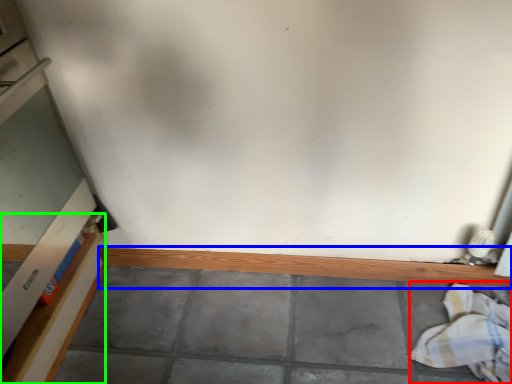
Question: Which object is positioned farthest from laundry (highlighted by a red box)? Select from ledge (highlighted by a blue box) and shelf (highlighted by a green box).

Choices:
 (A) ledge
 (B) shelf

Answer: (B)